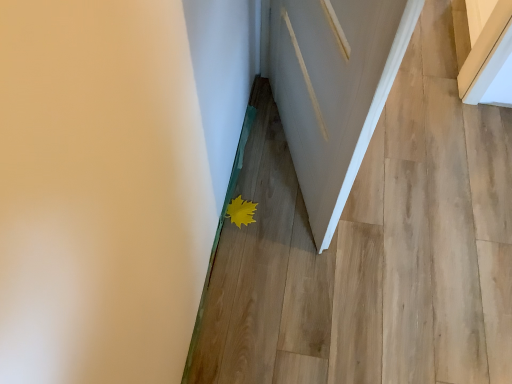
Locate an element on the screen. The image size is (512, 384). vacant space in white wood door at center (from a real-world perspective) is located at coordinates (283, 153).